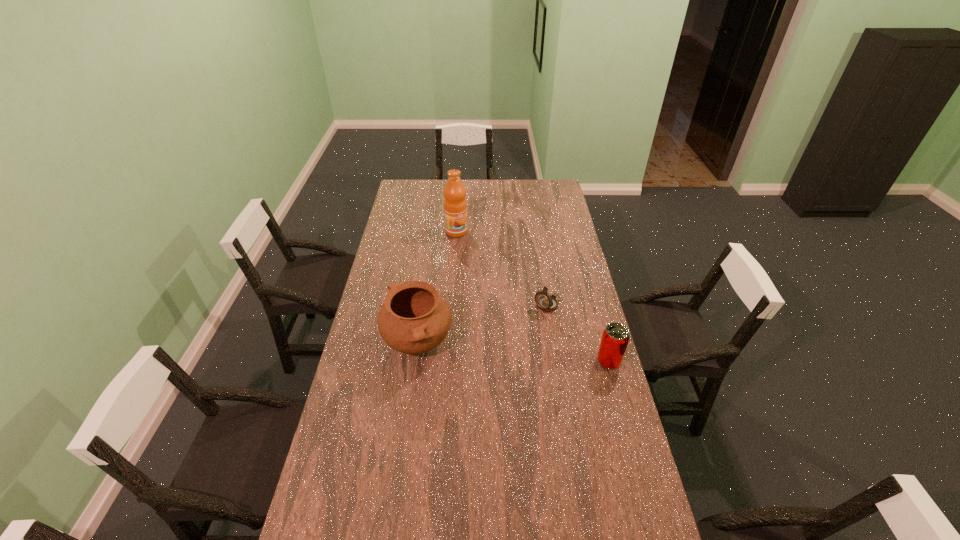
Identify the location of vacant position at the right edge of the desktop. Image resolution: width=960 pixels, height=540 pixels. (557, 234).

This screenshot has height=540, width=960. I want to click on vacant space at the far left corner, so click(x=411, y=179).

I want to click on free spot between the second shortest object and the second tallest object, so click(x=513, y=353).

This screenshot has width=960, height=540. I want to click on empty location between the pottery and the second shortest object, so click(513, 353).

The image size is (960, 540). Find the location of `free space between the soda can and the third shortest object`. free space between the soda can and the third shortest object is located at coordinates (x=513, y=353).

In order to click on empty space between the shortest object and the farthest object in this screenshot , I will do `click(502, 268)`.

Find the location of a particular element. free space between the third shortest object and the fruit juice is located at coordinates (437, 288).

What are the coordinates of `unoccupied area between the compass and the farthest object` in the screenshot? It's located at click(x=502, y=268).

What are the coordinates of `free space between the fruit juice and the third object from left to right` in the screenshot? It's located at (502, 268).

Locate an element on the screen. vacant space that's between the second shortest object and the third nearest object is located at coordinates (578, 333).